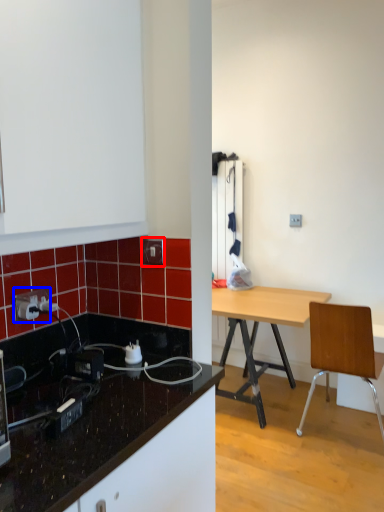
Question: Which of the following is the farthest to the observer, electric outlet (highlighted by a red box) or power outlet (highlighted by a blue box)?

Choices:
 (A) electric outlet
 (B) power outlet

Answer: (A)